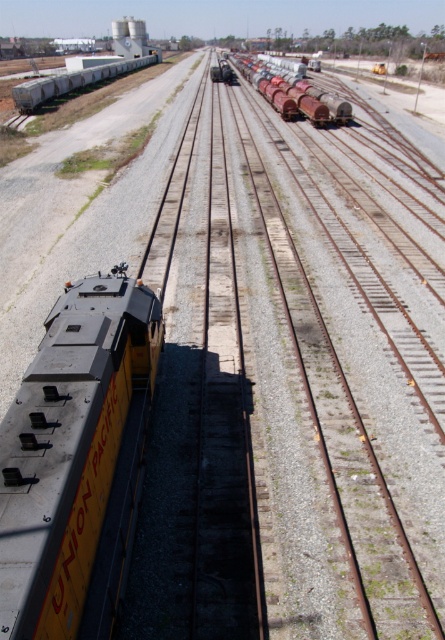
You are a railway inspector checking the alignment of the tracks in the yard. You notice the yellow matte train at center and the white matte train car at upper left. Which object has a narrower width when viewed from above?

The yellow matte train at center is thinner than the white matte train car at upper left, so it has a narrower width when viewed from above.